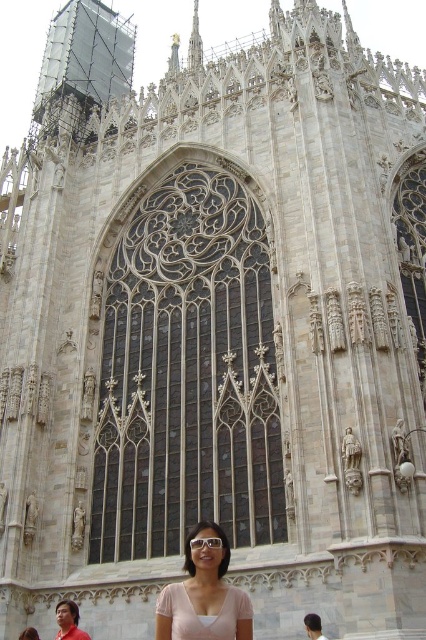
Question: Which point appears closest to the camera in this image?

Choices:
 (A) (189, 540)
 (B) (37, 634)
 (C) (219, 563)
 (D) (89, 522)

Answer: (C)

Question: Is dark stained glass at center smaller than pink matte shirt at center?

Choices:
 (A) yes
 (B) no

Answer: (B)

Question: Can you confirm if pink matte shirt at center is positioned above matte pink blouse at lower center?

Choices:
 (A) yes
 (B) no

Answer: (A)

Question: Considering the real-world distances, which object is farthest from the pink matte shirt at center?

Choices:
 (A) transparent plastic goggles at center
 (B) dark stained glass at center

Answer: (B)

Question: Can you confirm if dark stained glass at center is positioned below transparent plastic goggles at center?

Choices:
 (A) no
 (B) yes

Answer: (A)

Question: Which point appears farthest from the camera in this image?

Choices:
 (A) (195, 547)
 (B) (120, 371)
 (C) (187, 584)

Answer: (B)